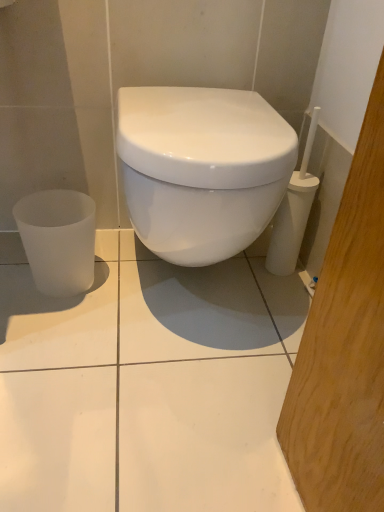
Find the location of `free location above white glossy toilet at center (from a real-world perspective)`. free location above white glossy toilet at center (from a real-world perspective) is located at coordinates (188, 105).